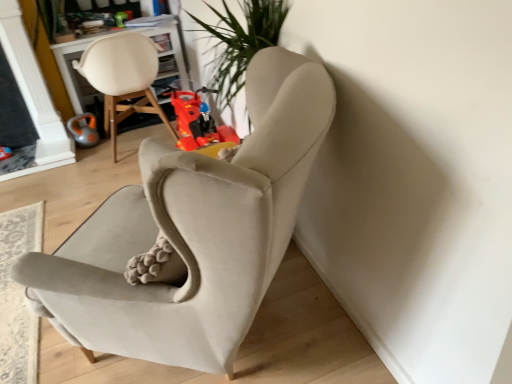
This screenshot has width=512, height=384. Identify the location of free point above suede beige armchair at center, positioned as the second chair in left-to-right order (from a real-world perspective). (74, 204).